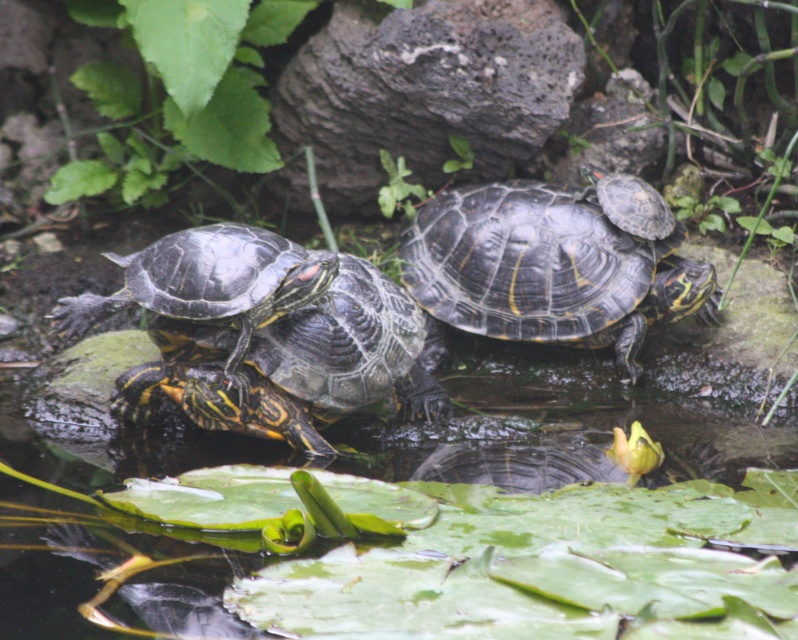
Question: Which point is closer to the camera taking this photo?

Choices:
 (A) (232, 292)
 (B) (623, 257)

Answer: (A)

Question: Does shiny black turtle at center lie behind shiny dark green tortoise at center?

Choices:
 (A) yes
 (B) no

Answer: (A)

Question: Which of the following is the farthest from the observer?

Choices:
 (A) (141, 301)
 (B) (595, 264)

Answer: (B)

Question: Can you confirm if shiny black turtle at center is positioned above shiny dark green tortoise at center?

Choices:
 (A) no
 (B) yes

Answer: (B)

Question: Is shiny black turtle at center wider than shiny dark green tortoise at center?

Choices:
 (A) yes
 (B) no

Answer: (A)

Question: Which object is closer to the camera taking this photo?

Choices:
 (A) shiny dark green tortoise at center
 (B) shiny black turtle at center

Answer: (A)